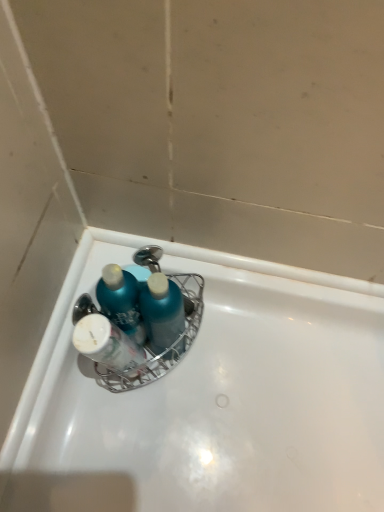
You are a GUI agent. You are given a task and a screenshot of the screen. Output one action in this format:
    pyautogui.click(x=<x>, y=<y>)
    Task: Click on the vacant space to the right of white glossy bottle at center
    This screenshot has width=384, height=512.
    Given the screenshot: What is the action you would take?
    point(218,380)